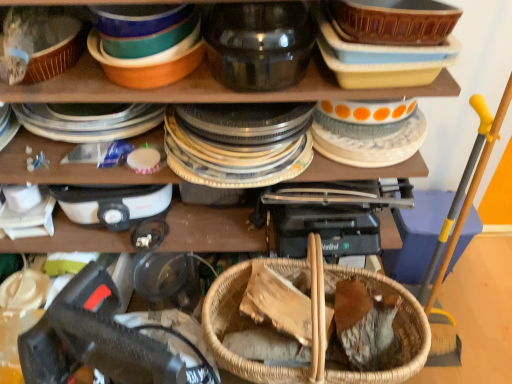
The width and height of the screenshot is (512, 384). Describe the element at coordinates (368, 140) in the screenshot. I see `white glossy plate at upper right, placed as the first tableware when sorted from right to left` at that location.

Where is `white glossy plate at upper right, the 2th tableware positioned from the left`? white glossy plate at upper right, the 2th tableware positioned from the left is located at coordinates (368, 140).

What's the angular difference between white plastic appliance at upper left and white glossy plate at upper right, the 2th tableware positioned from the left,'s facing directions?

The angular difference between white plastic appliance at upper left and white glossy plate at upper right, the 2th tableware positioned from the left, is 0.000896 degrees.

Are white plastic appliance at upper left and white glossy plate at upper right, placed as the first tableware when sorted from right to left, far apart?

No, white plastic appliance at upper left is in close proximity to white glossy plate at upper right, placed as the first tableware when sorted from right to left.

Is white plastic appliance at upper left inside the boundaries of white glossy plate at upper right, placed as the first tableware when sorted from right to left, or outside?

white plastic appliance at upper left cannot be found inside white glossy plate at upper right, placed as the first tableware when sorted from right to left.

At what (x,y) coordinates should I click in order to perform the action: click on appliance below the white glossy plate at upper right, placed as the first tableware when sorted from right to left (from the image's perspective). Please return your answer as a coordinate pair (x, y). The width and height of the screenshot is (512, 384). Looking at the image, I should click on (112, 203).

Is transparent glass jar at upper center, the second tableware in the right-to-left sequence, at the left side of woven wood basket at center?

Correct, you'll find transparent glass jar at upper center, the second tableware in the right-to-left sequence, to the left of woven wood basket at center.

Does transparent glass jar at upper center, the second tableware in the right-to-left sequence, turn towards woven wood basket at center?

Answer: No, transparent glass jar at upper center, the second tableware in the right-to-left sequence, is not oriented towards woven wood basket at center.

From the image's perspective, is transparent glass jar at upper center, the second tableware in the right-to-left sequence, on top of woven wood basket at center?

Yes.

Relative to woven wood basket at center, is transparent glass jar at upper center, the first tableware from the left, in front or behind?

In the image, transparent glass jar at upper center, the first tableware from the left, appears in front of woven wood basket at center.

Is point (224, 294) positioned before point (271, 46)?

No.

From a real-world perspective, does woven wood basket at center stand above transparent glass jar at upper center, the first tableware from the left?

No.

Can you tell me how much woven wood basket at center and transparent glass jar at upper center, the second tableware in the right-to-left sequence, differ in facing direction?

0.855 degrees.

Who is shorter, woven wood basket at center or transparent glass jar at upper center, the second tableware in the right-to-left sequence?

With less height is transparent glass jar at upper center, the second tableware in the right-to-left sequence.

Does point (167, 189) appear closer or farther from the camera than point (244, 276)?

Point (167, 189).

Between white plastic appliance at upper left and woven wood basket at center, which one appears on the left side from the viewer's perspective?

From the viewer's perspective, white plastic appliance at upper left appears more on the left side.

Where is `basket lying in front of the white plastic appliance at upper left`? basket lying in front of the white plastic appliance at upper left is located at coordinates (239, 329).

Consider the image. Is transparent glass jar at upper center, the second tableware in the right-to-left sequence, in contact with white glossy plate at upper right, placed as the first tableware when sorted from right to left?

transparent glass jar at upper center, the second tableware in the right-to-left sequence, and white glossy plate at upper right, placed as the first tableware when sorted from right to left, are not in contact.

Can you confirm if transparent glass jar at upper center, the first tableware from the left, is thinner than white glossy plate at upper right, the 2th tableware positioned from the left?

Indeed, transparent glass jar at upper center, the first tableware from the left, has a lesser width compared to white glossy plate at upper right, the 2th tableware positioned from the left.

From a real-world perspective, between transparent glass jar at upper center, the first tableware from the left, and white glossy plate at upper right, the 2th tableware positioned from the left, who is vertically higher?

In real-world perspective, transparent glass jar at upper center, the first tableware from the left, is above.

Identify the location of tableware below the transparent glass jar at upper center, the second tableware in the right-to-left sequence (from the image's perspective). The width and height of the screenshot is (512, 384). (368, 140).

Considering the positions of point (368, 139) and point (424, 344), is point (368, 139) closer or farther from the camera than point (424, 344)?

Point (368, 139).

Is white glossy plate at upper right, the 2th tableware positioned from the left, located outside woven wood basket at center?

Indeed, white glossy plate at upper right, the 2th tableware positioned from the left, is completely outside woven wood basket at center.

Is the depth of white glossy plate at upper right, placed as the first tableware when sorted from right to left, greater than that of woven wood basket at center?

Yes, it is behind woven wood basket at center.

From the picture: Which object is wider, white glossy plate at upper right, the 2th tableware positioned from the left, or woven wood basket at center?

white glossy plate at upper right, the 2th tableware positioned from the left.

Is woven wood basket at center thinner than white plastic appliance at upper left?

Incorrect, the width of woven wood basket at center is not less than that of white plastic appliance at upper left.

Is the surface of woven wood basket at center in direct contact with white plastic appliance at upper left?

There is a gap between woven wood basket at center and white plastic appliance at upper left.

From a real-world perspective, relative to white plastic appliance at upper left, is woven wood basket at center vertically above or below?

From a real-world perspective, woven wood basket at center is physically below white plastic appliance at upper left.

Does woven wood basket at center contain white plastic appliance at upper left?

No, white plastic appliance at upper left is not a part of woven wood basket at center.

At what (x,y) coordinates should I click in order to perform the action: click on appliance below the white glossy plate at upper right, the 2th tableware positioned from the left (from the image's perspective). Please return your answer as a coordinate pair (x, y). This screenshot has height=384, width=512. Looking at the image, I should click on (112, 203).

Identify the location of tableware that appears on the left of woven wood basket at center. (259, 44).

Based on their spatial positions, is woven wood basket at center or white glossy plate at upper right, the 2th tableware positioned from the left, closer to transparent glass jar at upper center, the second tableware in the right-to-left sequence?

white glossy plate at upper right, the 2th tableware positioned from the left.

Considering their positions, is white glossy plate at upper right, placed as the first tableware when sorted from right to left, positioned closer to woven wood basket at center than transparent glass jar at upper center, the second tableware in the right-to-left sequence?

Among the two, white glossy plate at upper right, placed as the first tableware when sorted from right to left, is located nearer to woven wood basket at center.

Looking at this image, from the image, which object appears to be farther from transparent glass jar at upper center, the second tableware in the right-to-left sequence, white plastic appliance at upper left or white glossy plate at upper right, placed as the first tableware when sorted from right to left?

Based on the image, white plastic appliance at upper left appears to be further to transparent glass jar at upper center, the second tableware in the right-to-left sequence.

From the image, which object appears to be nearer to white glossy plate at upper right, the 2th tableware positioned from the left, transparent glass jar at upper center, the first tableware from the left, or woven wood basket at center?

transparent glass jar at upper center, the first tableware from the left, is closer to white glossy plate at upper right, the 2th tableware positioned from the left.

Considering their positions, is transparent glass jar at upper center, the second tableware in the right-to-left sequence, positioned further to woven wood basket at center than white glossy plate at upper right, placed as the first tableware when sorted from right to left?

transparent glass jar at upper center, the second tableware in the right-to-left sequence.

When comparing their distances from white plastic appliance at upper left, does white glossy plate at upper right, the 2th tableware positioned from the left, or woven wood basket at center seem further?

Based on the image, white glossy plate at upper right, the 2th tableware positioned from the left, appears to be further to white plastic appliance at upper left.

Estimate the real-world distances between objects in this image. Which object is further from white plastic appliance at upper left, transparent glass jar at upper center, the second tableware in the right-to-left sequence, or white glossy plate at upper right, the 2th tableware positioned from the left?

The object further to white plastic appliance at upper left is white glossy plate at upper right, the 2th tableware positioned from the left.

When comparing their distances from transparent glass jar at upper center, the first tableware from the left, does white glossy plate at upper right, placed as the first tableware when sorted from right to left, or white plastic appliance at upper left seem further?

white plastic appliance at upper left is positioned further to the anchor transparent glass jar at upper center, the first tableware from the left.

What are the coordinates of `basket between white plastic appliance at upper left and white glossy plate at upper right, the 2th tableware positioned from the left, from left to right` in the screenshot? It's located at click(x=239, y=329).

This screenshot has height=384, width=512. In order to click on tableware situated between white plastic appliance at upper left and white glossy plate at upper right, the 2th tableware positioned from the left, from left to right in this screenshot , I will do `click(259, 44)`.

Where is `tableware between transparent glass jar at upper center, the first tableware from the left, and woven wood basket at center from top to bottom`? The height and width of the screenshot is (384, 512). tableware between transparent glass jar at upper center, the first tableware from the left, and woven wood basket at center from top to bottom is located at coordinates (368, 140).

What are the coordinates of `appliance between transparent glass jar at upper center, the first tableware from the left, and woven wood basket at center from top to bottom` in the screenshot? It's located at (112, 203).